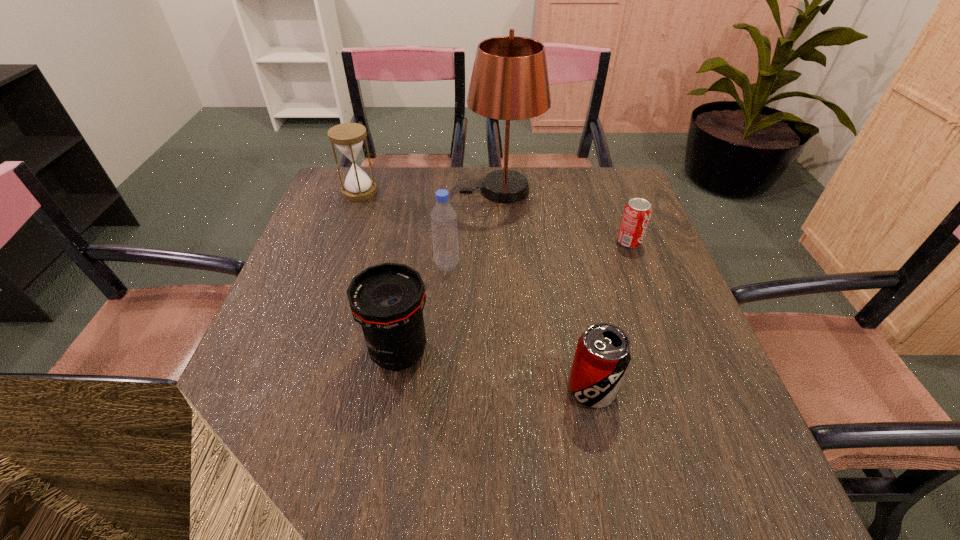
Image resolution: width=960 pixels, height=540 pixels. Identify the location of free space located 0.250m on the front-facing side of the tallest object. (376, 190).

Where is `vacant space situated 0.370m on the right of the bottle`? This screenshot has height=540, width=960. vacant space situated 0.370m on the right of the bottle is located at coordinates (610, 265).

You are a GUI agent. You are given a task and a screenshot of the screen. Output one action in this format:
    pyautogui.click(x=<x>, y=<y>)
    Task: Click on the blank space located on the right of the hourglass
    The image size is (960, 540).
    Given the screenshot: What is the action you would take?
    pyautogui.click(x=474, y=192)

Find the location of a particular element. This screenshot has height=540, width=960. vacant space situated 0.130m on the front of the telephoto lens is located at coordinates (383, 446).

The image size is (960, 540). I want to click on vacant region located on the left of the nearer soda can, so click(x=537, y=388).

I want to click on vacant space situated on the back of the right soda can, so click(x=612, y=196).

This screenshot has width=960, height=540. Find the location of `lampshade that is at the far edge`. lampshade that is at the far edge is located at coordinates (509, 81).

The image size is (960, 540). I want to click on hourglass that is at the far edge, so click(x=348, y=137).

Find the location of a particular element. Image resolution: width=960 pixels, height=540 pixels. object that is at the left edge is located at coordinates click(348, 137).

Identify the location of object that is positioned at the right edge. The width and height of the screenshot is (960, 540). (637, 212).